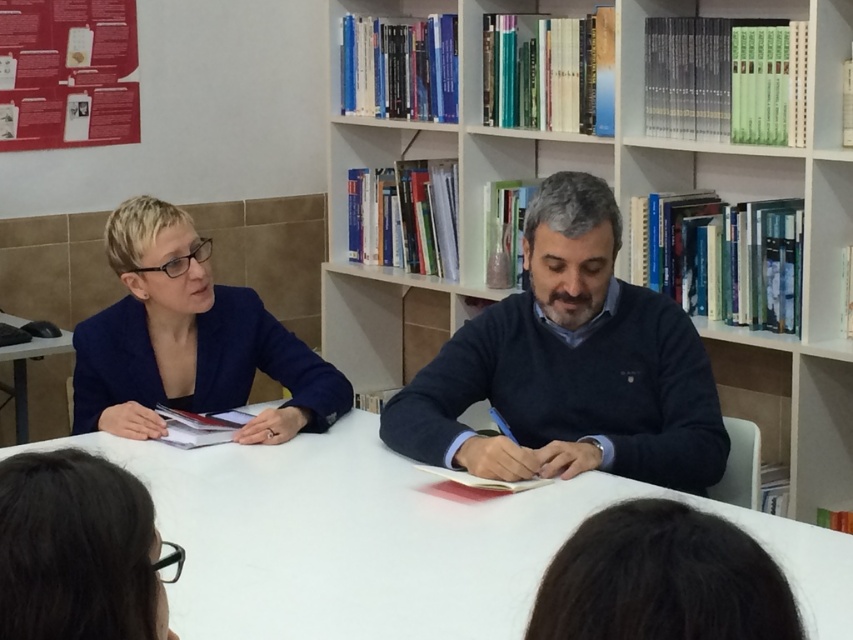
Is white smooth table at center positioned behind wooden bookshelf at center?

No.

Does white smooth table at center have a smaller size compared to wooden bookshelf at center?

Yes.

Between point (372, 444) and point (836, 433), which one is positioned behind?

The point (836, 433) is more distant.

Find the location of a particular element. white smooth table at center is located at coordinates (395, 540).

Can you confirm if dark blue sweater at center is positioned above blue fabric jacket at left?

No.

Is dark blue sweater at center shorter than blue fabric jacket at left?

No.

The width and height of the screenshot is (853, 640). What are the coordinates of `dark blue sweater at center` in the screenshot? It's located at (570, 365).

Does blue fabric jacket at left have a larger size compared to dark brown hair at lower left?

Indeed, blue fabric jacket at left has a larger size compared to dark brown hair at lower left.

Does point (283, 384) come behind point (117, 484)?

Yes.

Find the location of a particular element. The image size is (853, 640). blue fabric jacket at left is located at coordinates (189, 340).